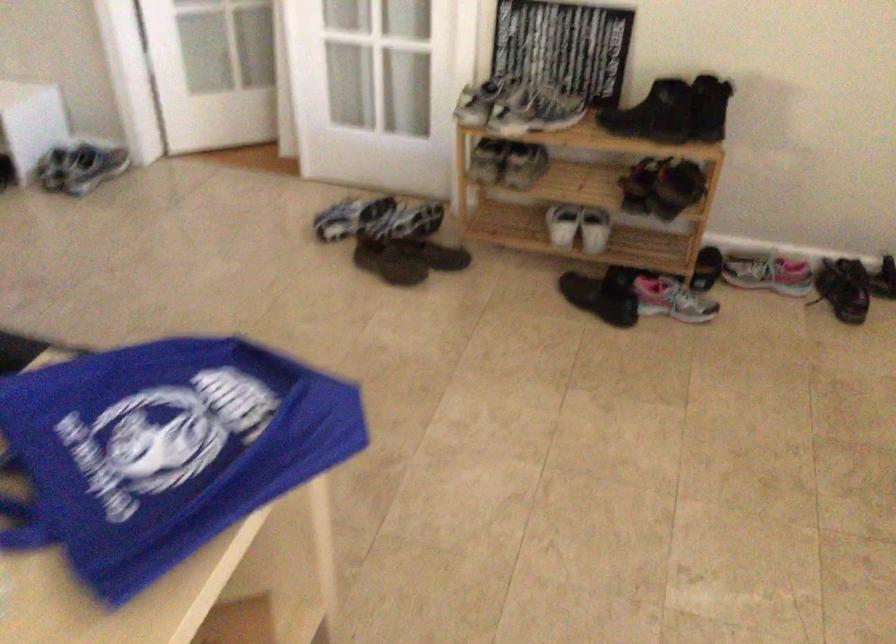
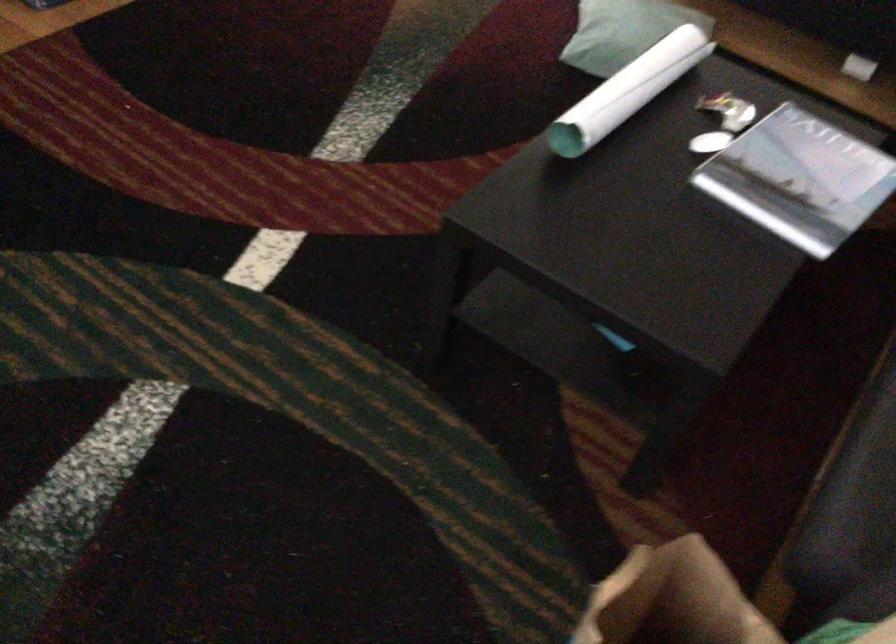
First-person continuous shooting, in which direction is the camera rotating?

The camera's rotation is toward left-down.